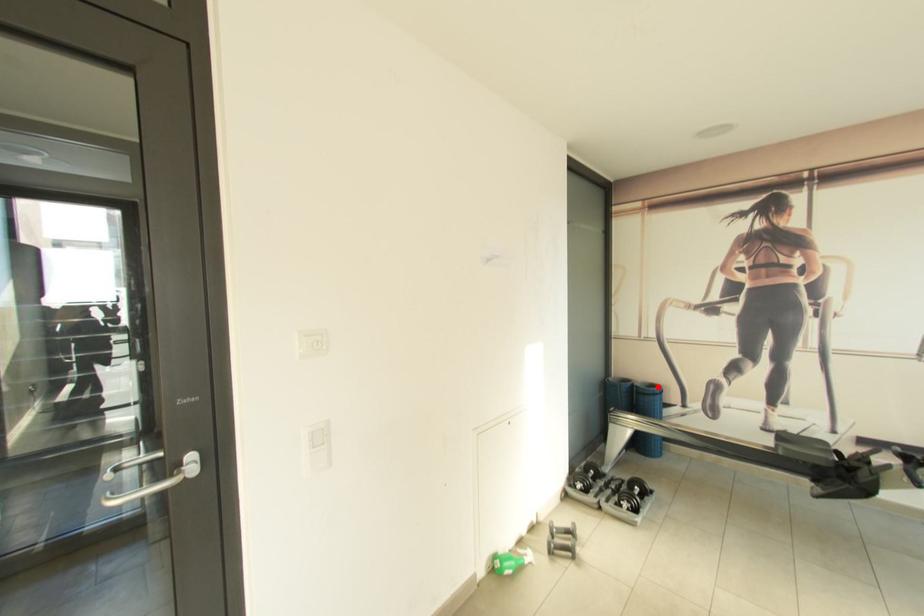
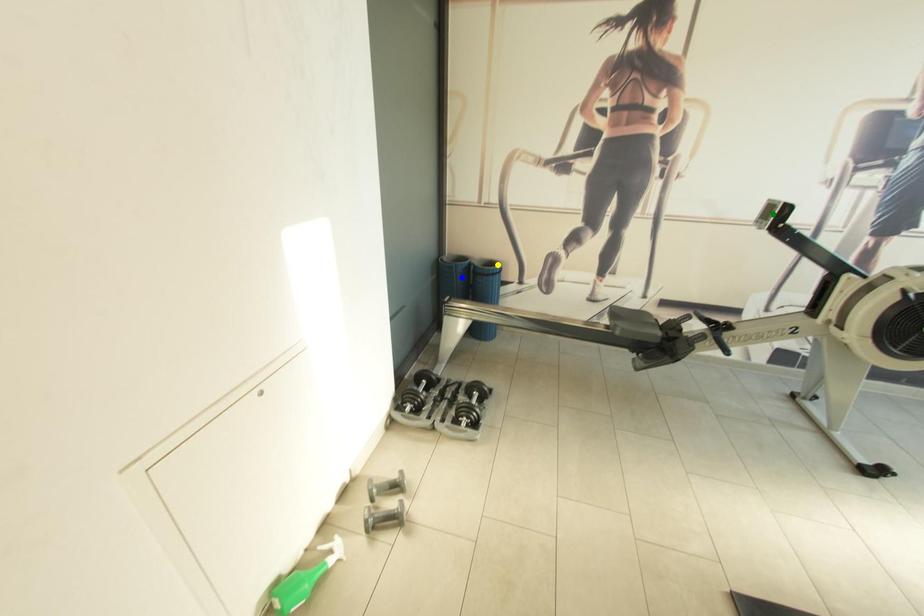
Question: I am providing you with two images of the same scene from different viewpoints. A red point is marked on the first image. You are given multiple points on the second image. Can you choose the point in image 2 that corresponds to the point in image 1?

Choices:
 (A) green point
 (B) blue point
 (C) yellow point

Answer: (C)